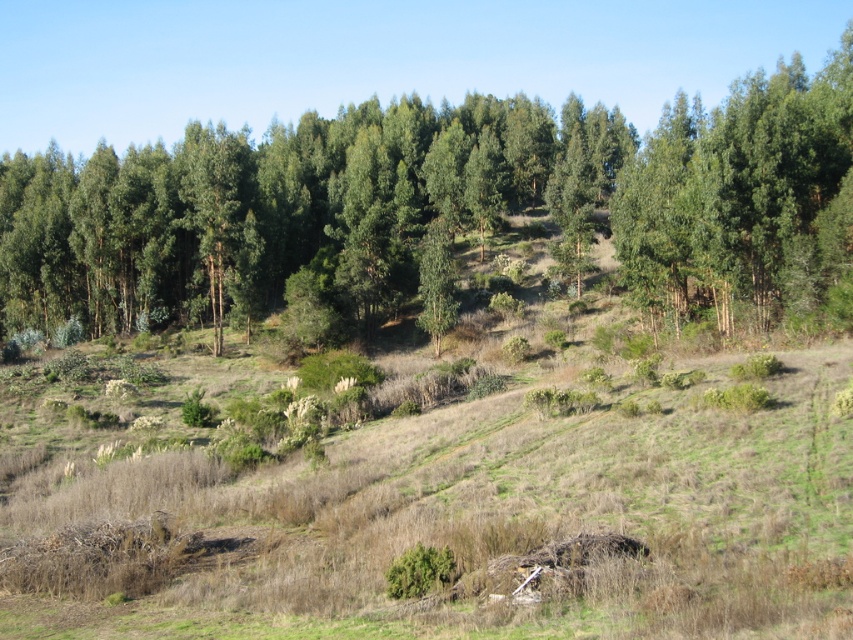
Question: Is green leafy trees at center further to camera compared to green leafy tree at upper right?

Choices:
 (A) no
 (B) yes

Answer: (B)

Question: Observing the image, what is the correct spatial positioning of green leafy trees at center in reference to green leafy tree at upper right?

Choices:
 (A) below
 (B) above

Answer: (B)

Question: Which point appears farthest from the camera in this image?

Choices:
 (A) (485, 154)
 (B) (697, 106)

Answer: (B)

Question: Is green leafy trees at center below green leafy tree at upper right?

Choices:
 (A) yes
 (B) no

Answer: (B)

Question: Among these objects, which one is farthest from the camera?

Choices:
 (A) green leafy tree at upper right
 (B) green leafy trees at center

Answer: (B)